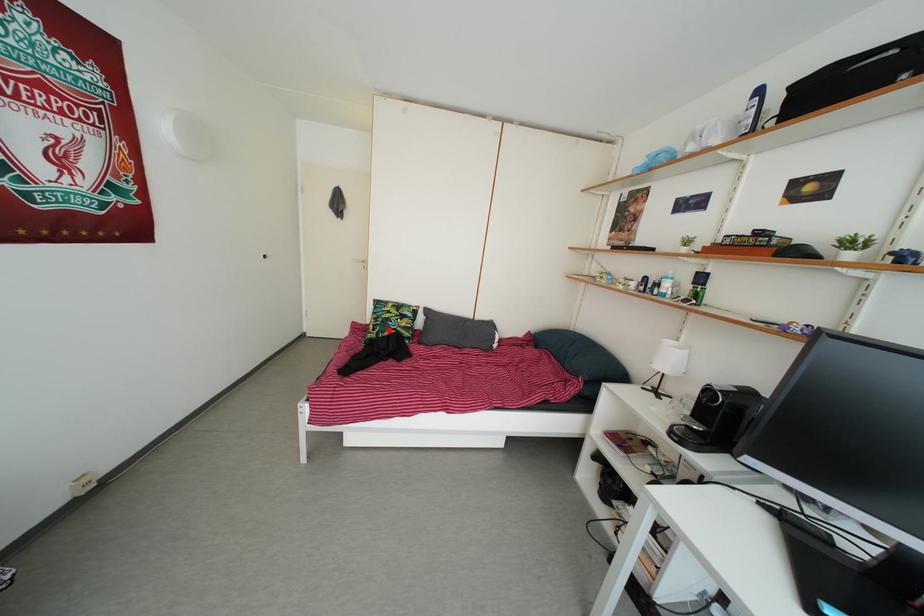
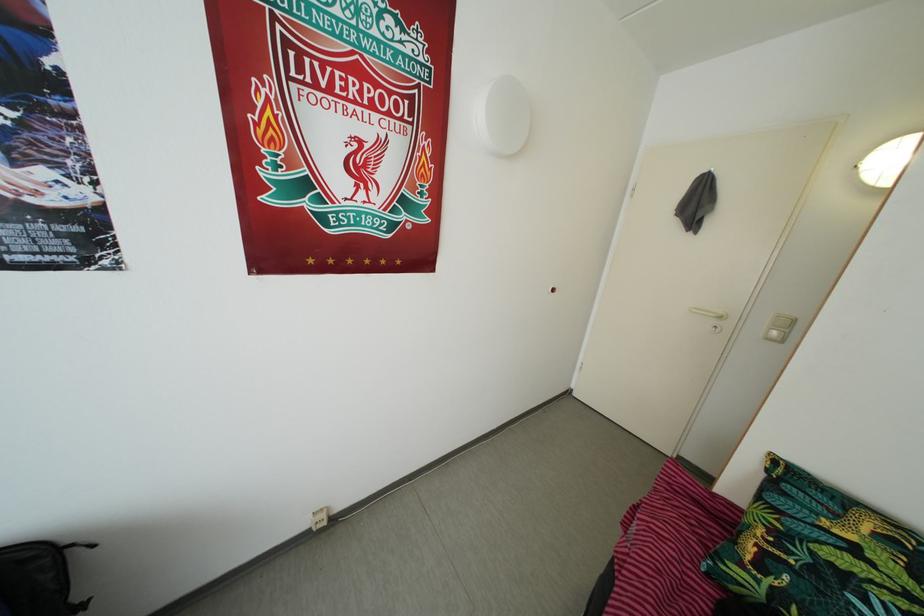
Locate, in the second image, the point that corresponds to the highlighted location in the first image.

(820, 578)